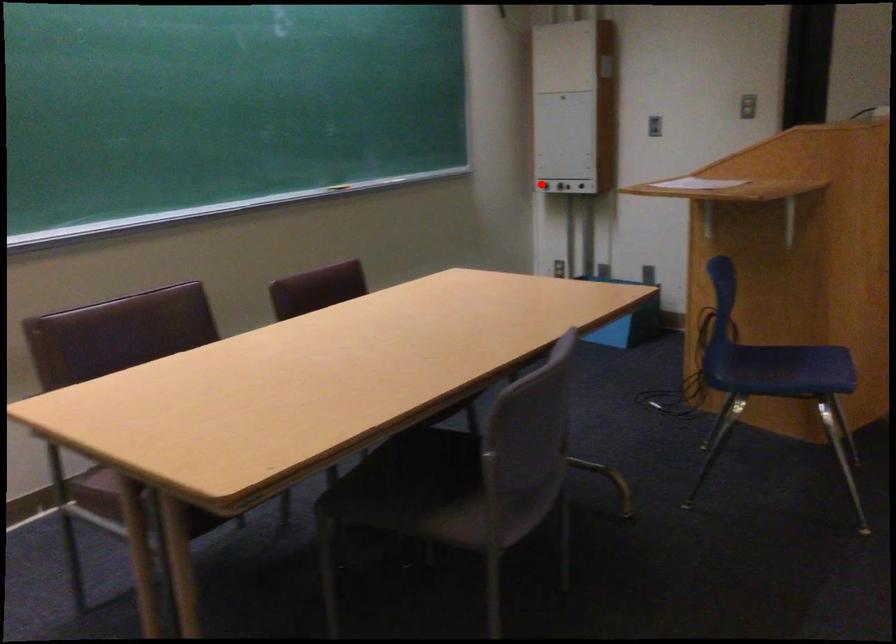
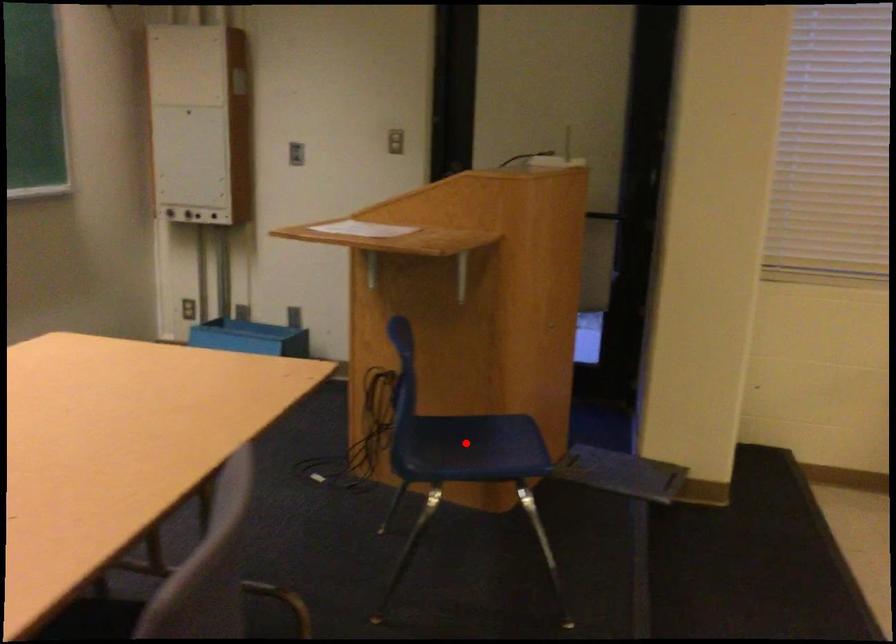
I am providing you with two images of the same scene from different viewpoints. A red point is marked on the first image and another point is marked on the second image. Is the red point in image1 aligned with the point shown in image2?

No